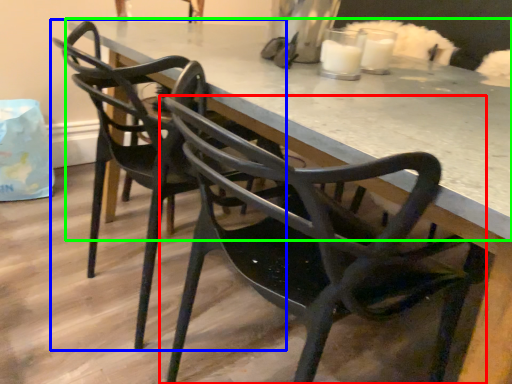
Question: Which is farther away from chair (highlighted by a red box)? chair (highlighted by a blue box) or table (highlighted by a green box)?

Choices:
 (A) chair
 (B) table

Answer: (A)